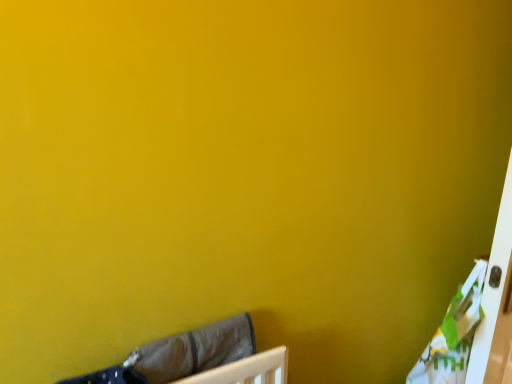
In order to face leather-like brown bag at lower left, should I rotate leftwards or rightwards?

Turn left approximately 7.900 degrees to face it.

Locate an element on the screen. This screenshot has width=512, height=384. leather-like brown bag at lower left is located at coordinates (199, 359).

What do you see at coordinates (199, 359) in the screenshot?
I see `leather-like brown bag at lower left` at bounding box center [199, 359].

I want to click on leather-like brown bag at lower left, so click(x=199, y=359).